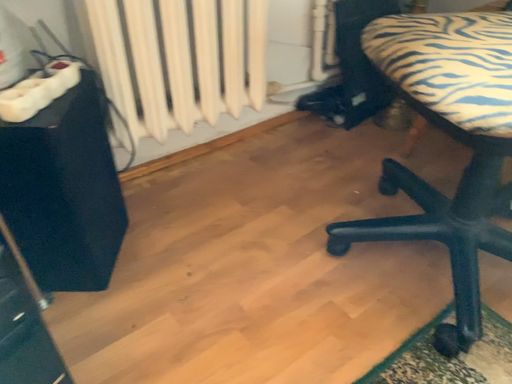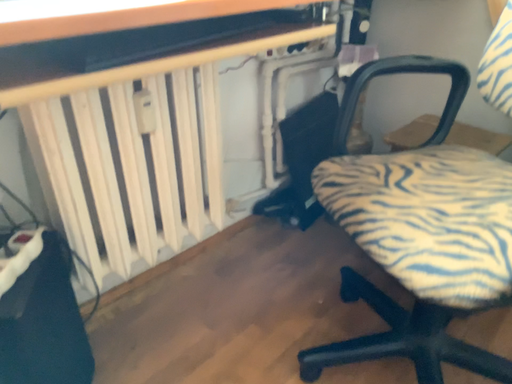
Question: How did the camera likely rotate when shooting the video?

Choices:
 (A) rotated upward
 (B) rotated downward

Answer: (A)